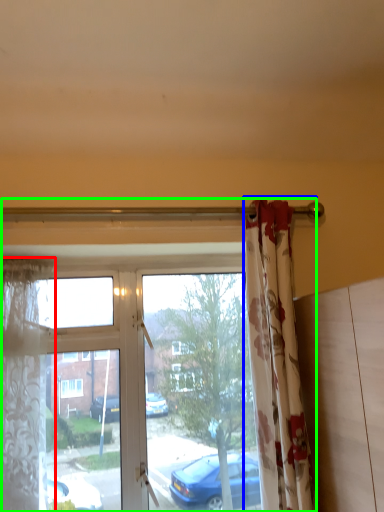
Question: Based on their relative distances, which object is nearer to curtain (highlighted by a red box)? Choose from curtain (highlighted by a blue box) and window (highlighted by a green box).

Choices:
 (A) curtain
 (B) window

Answer: (B)